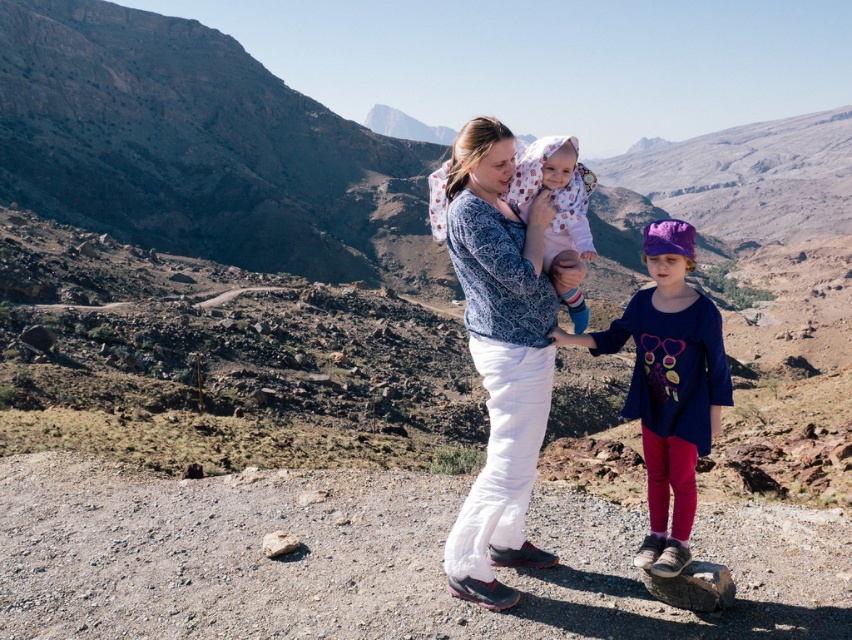
Who is more forward, (452,211) or (557,145)?

Point (452,211) is more forward.

Which is more to the left, blue patterned sweater at center or fluffy pink blanket at center?

From the viewer's perspective, blue patterned sweater at center appears more on the left side.

Describe the element at coordinates (501, 352) in the screenshot. I see `blue patterned sweater at center` at that location.

Find the location of a particular element. This screenshot has height=640, width=852. blue patterned sweater at center is located at coordinates 501,352.

Is the position of blue cotton shirt at center less distant than that of fluffy pink blanket at center?

Yes, it is.

This screenshot has width=852, height=640. I want to click on blue cotton shirt at center, so click(x=668, y=385).

Where is `blue cotton shirt at center`? blue cotton shirt at center is located at coordinates (668, 385).

Locate an element on the screen. blue patterned sweater at center is located at coordinates (501, 352).

Between blue patterned sweater at center and blue cotton shirt at center, which one has less height?

blue cotton shirt at center

The height and width of the screenshot is (640, 852). In order to click on blue patterned sweater at center in this screenshot , I will do `click(501, 352)`.

Locate an element on the screen. blue patterned sweater at center is located at coordinates (501, 352).